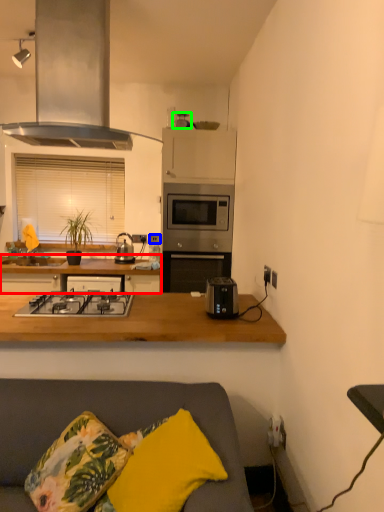
Question: Estimate the real-world distances between objects in this image. Which object is farther from countertop (highlighted by a red box), electric outlet (highlighted by a blue box) or appliance (highlighted by a green box)?

Choices:
 (A) electric outlet
 (B) appliance

Answer: (B)